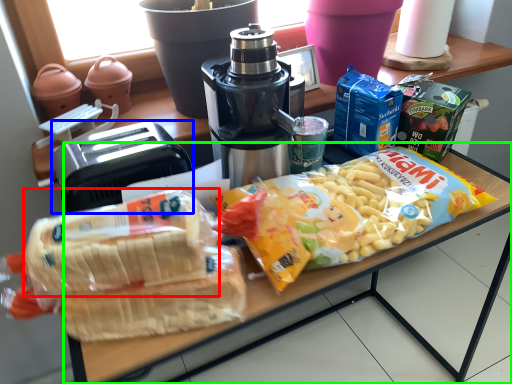
Question: Which object is positioned farthest from snack (highlighted by a red box)? Select from toaster (highlighted by a blue box) and table (highlighted by a green box).

Choices:
 (A) toaster
 (B) table

Answer: (B)